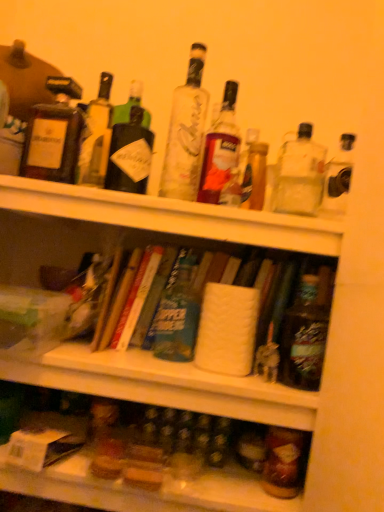
Question: From a real-world perspective, is matte brown bottle at upper left, which is the ninth bottle in right-to-left order, under translucent glass bottle at lower right, the third bottle viewed from the right?

Choices:
 (A) no
 (B) yes

Answer: (A)

Question: From the image's perspective, is matte brown bottle at upper left, which is the ninth bottle in right-to-left order, under translucent glass bottle at lower right, marked as the 7th bottle in a left-to-right arrangement?

Choices:
 (A) no
 (B) yes

Answer: (A)

Question: Considering the relative sizes of matte brown bottle at upper left, which is the 1th bottle from left to right, and translucent glass bottle at lower right, marked as the 7th bottle in a left-to-right arrangement, in the image provided, is matte brown bottle at upper left, which is the 1th bottle from left to right, smaller than translucent glass bottle at lower right, marked as the 7th bottle in a left-to-right arrangement,?

Choices:
 (A) no
 (B) yes

Answer: (A)

Question: Is matte brown bottle at upper left, which is the 1th bottle from left to right, shorter than translucent glass bottle at lower right, the third bottle viewed from the right?

Choices:
 (A) no
 (B) yes

Answer: (A)

Question: Is matte brown bottle at upper left, which is the ninth bottle in right-to-left order, in contact with translucent glass bottle at lower right, the third bottle viewed from the right?

Choices:
 (A) yes
 (B) no

Answer: (B)

Question: From a real-world perspective, is translucent glass bottle at center, which appears as the 5th bottle when viewed from the left, physically located above or below translucent glass bottle at lower right, the third bottle viewed from the right?

Choices:
 (A) above
 (B) below

Answer: (A)

Question: Is translucent glass bottle at center, placed as the fifth bottle when sorted from right to left, taller or shorter than translucent glass bottle at lower right, marked as the 7th bottle in a left-to-right arrangement?

Choices:
 (A) short
 (B) tall

Answer: (B)

Question: In terms of width, does translucent glass bottle at center, which appears as the 5th bottle when viewed from the left, look wider or thinner when compared to translucent glass bottle at lower right, marked as the 7th bottle in a left-to-right arrangement?

Choices:
 (A) thin
 (B) wide

Answer: (B)

Question: Relative to translucent glass bottle at lower right, the third bottle viewed from the right, is translucent glass bottle at center, which appears as the 5th bottle when viewed from the left, in front or behind?

Choices:
 (A) front
 (B) behind

Answer: (B)

Question: Would you say clear glass bottle at upper right, the second bottle viewed from the right, is to the left or to the right of clear glass bottle at center, marked as the fourth bottle in a left-to-right arrangement, in the picture?

Choices:
 (A) left
 (B) right

Answer: (B)

Question: From a real-world perspective, is clear glass bottle at upper right, the 8th bottle viewed from the left, physically located above or below clear glass bottle at center, the sixth bottle positioned from the right?

Choices:
 (A) below
 (B) above

Answer: (A)

Question: In terms of width, does clear glass bottle at upper right, the 8th bottle viewed from the left, look wider or thinner when compared to clear glass bottle at center, the sixth bottle positioned from the right?

Choices:
 (A) wide
 (B) thin

Answer: (A)

Question: Does point (276, 194) appear closer or farther from the camera than point (168, 161)?

Choices:
 (A) farther
 (B) closer

Answer: (A)

Question: Is point (137, 309) positioned closer to the camera than point (102, 93)?

Choices:
 (A) closer
 (B) farther

Answer: (A)

Question: Is hardcover book at center taller or shorter than green glass bottle at upper left, arranged as the 2th bottle when viewed from the left?

Choices:
 (A) tall
 (B) short

Answer: (B)